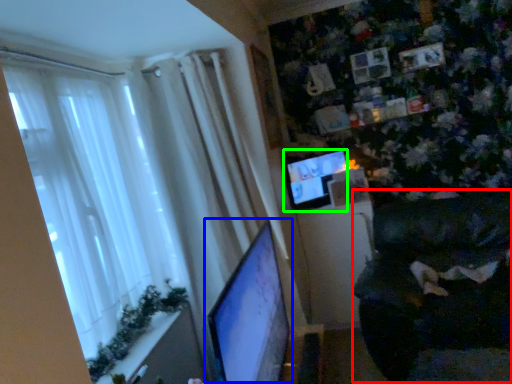
Question: Considering the real-world distances, which object is closest to swivel chair (highlighted by a red box)? computer monitor (highlighted by a blue box) or computer monitor (highlighted by a green box).

Choices:
 (A) computer monitor
 (B) computer monitor

Answer: (B)